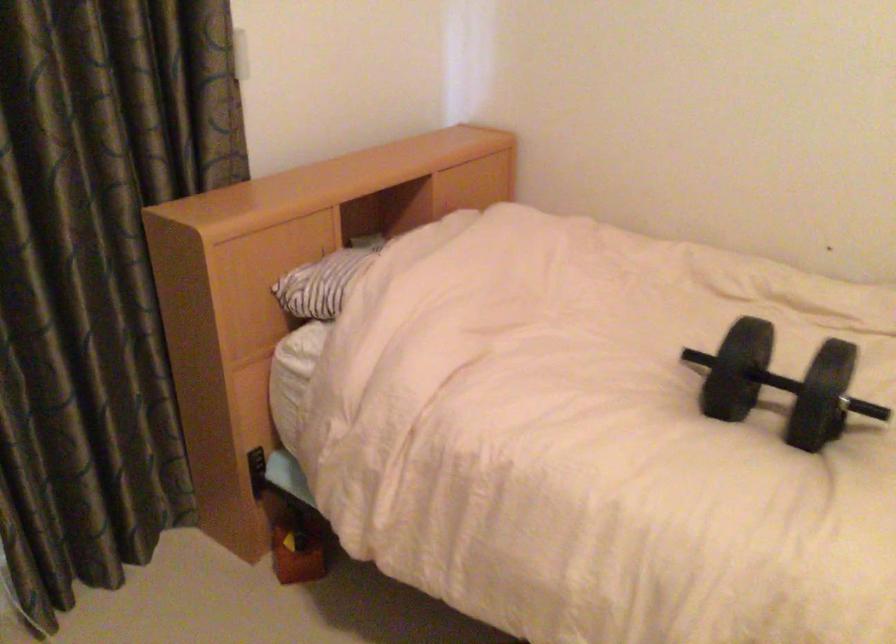
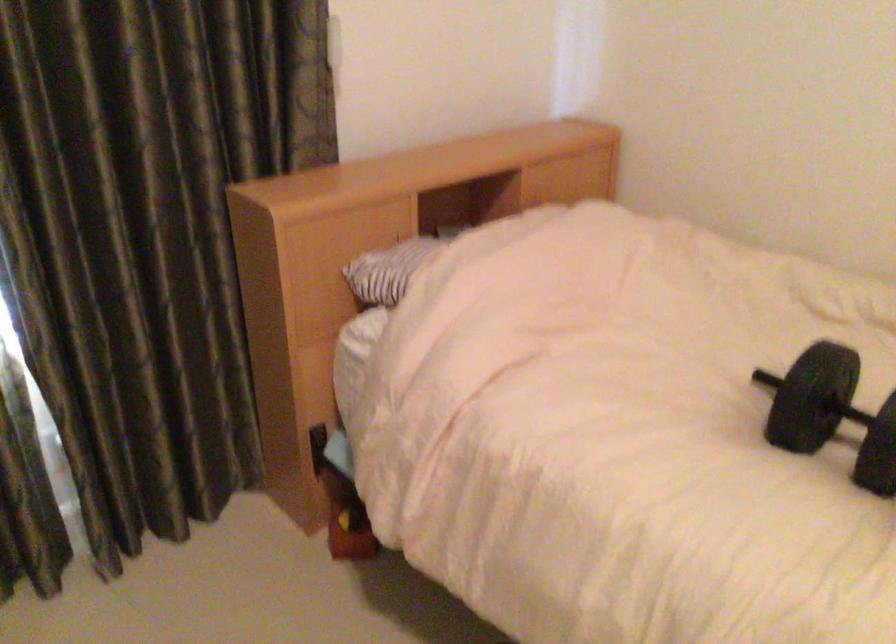
Where in the second image is the point corresponding to pixel 255 469 from the first image?

(317, 447)